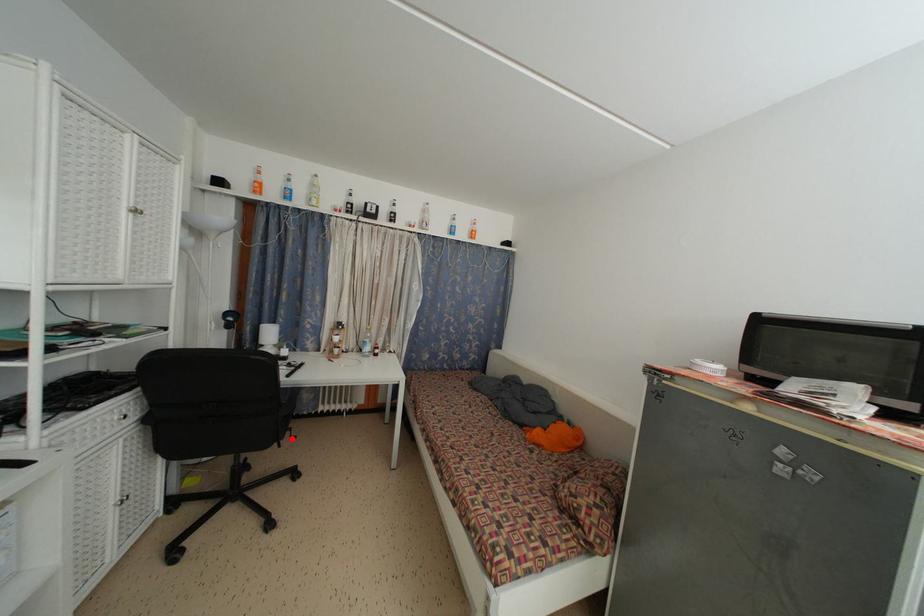
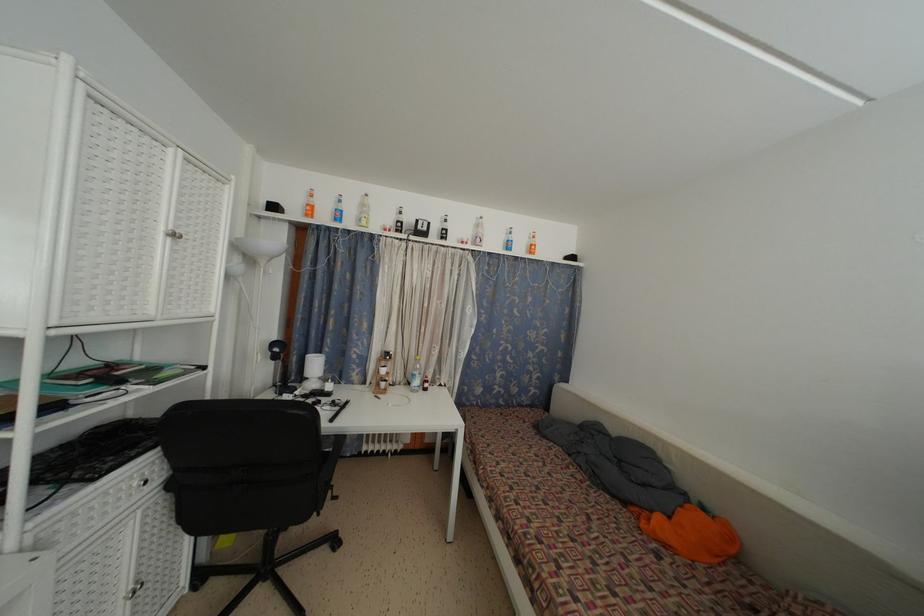
Question: I am providing you with two images of the same scene from different viewpoints. Image1 has a red point marked. In image2, the corresponding 3D location appears at what relative position? Reply with the corresponding letter.

Choices:
 (A) Closer
 (B) Farther

Answer: (B)